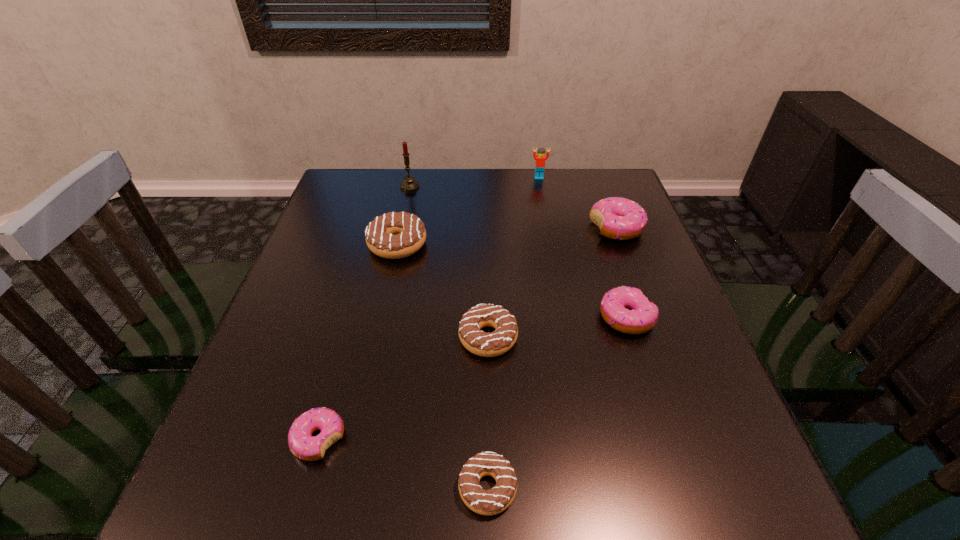
Where is `candle that is at the far edge`? The width and height of the screenshot is (960, 540). candle that is at the far edge is located at coordinates [x=409, y=184].

Locate an element on the screen. This screenshot has height=540, width=960. Lego present at the far edge is located at coordinates (540, 159).

Find the location of `doughnut that is at the far edge`. doughnut that is at the far edge is located at coordinates (618, 218).

In order to click on object present at the near edge in this screenshot , I will do `click(493, 501)`.

Where is `object at the far right corner`? object at the far right corner is located at coordinates (618, 218).

Locate an element on the screen. The width and height of the screenshot is (960, 540). vacant space at the far edge is located at coordinates [407, 206].

Identify the location of vacant region at the near edge of the desktop. (416, 506).

What are the coordinates of `free space at the left edge of the desktop` in the screenshot? It's located at (300, 378).

In the image, there is a desktop. Where is `free space at the right edge`? free space at the right edge is located at coordinates (650, 331).

The image size is (960, 540). I want to click on vacant space at the far left corner of the desktop, so click(x=375, y=212).